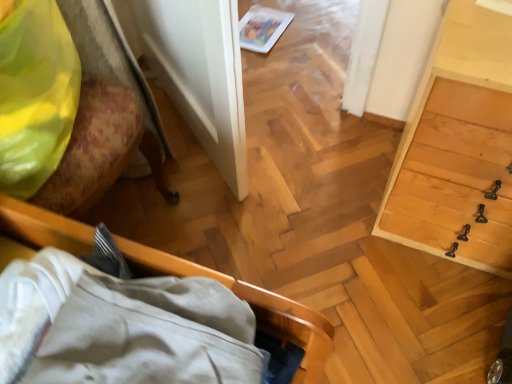
Where is `free spot to the right of white glossy magazine at upper center`? The height and width of the screenshot is (384, 512). free spot to the right of white glossy magazine at upper center is located at coordinates (308, 27).